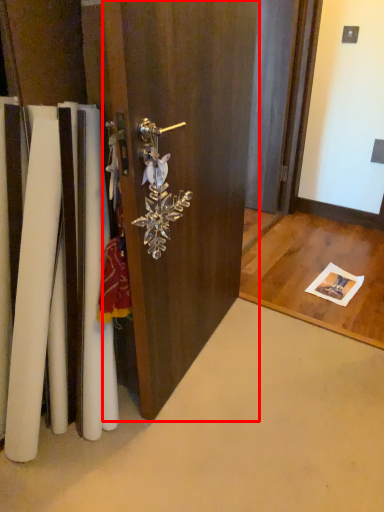
Question: Considering the relative positions of door (annotated by the red box) and door handle in the image provided, where is door (annotated by the red box) located with respect to the staircase?

Choices:
 (A) right
 (B) left

Answer: (A)